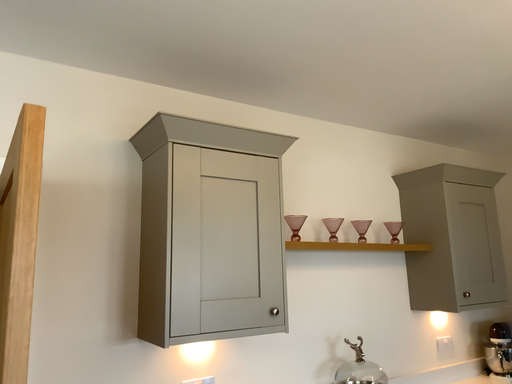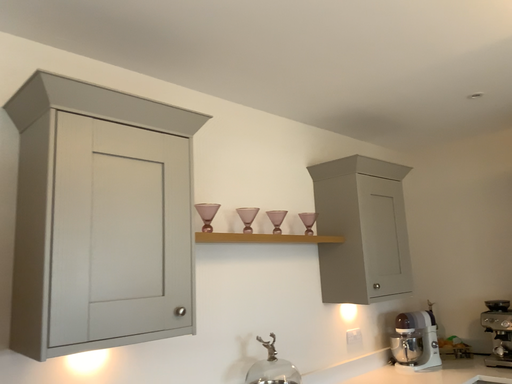
Question: Which way did the camera rotate in the video?

Choices:
 (A) rotated right
 (B) rotated left

Answer: (A)